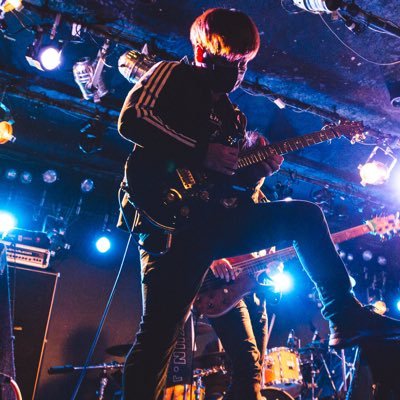
This screenshot has height=400, width=400. Find the location of `light`. light is located at coordinates (284, 285), (101, 244), (4, 224), (7, 132), (51, 56), (83, 75), (129, 69), (370, 166), (382, 310).